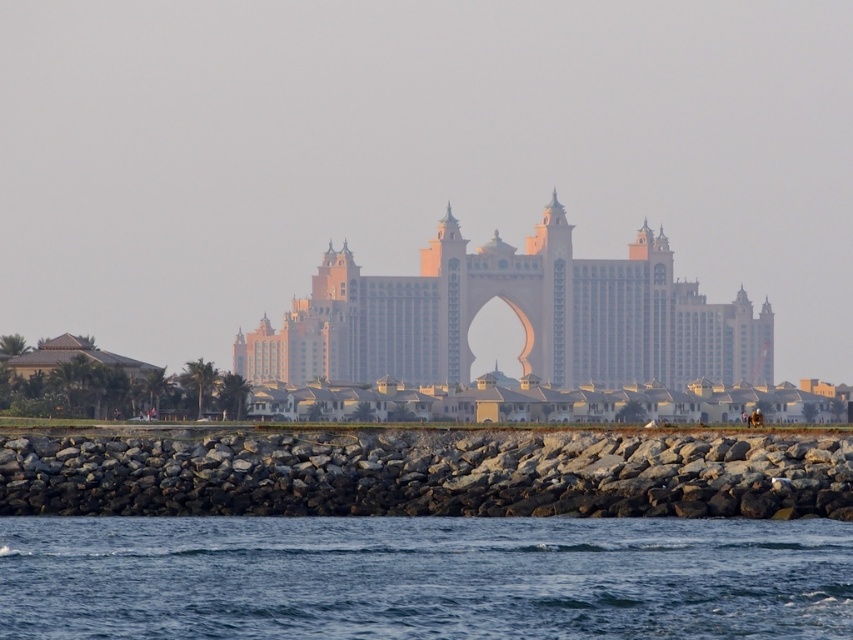
Question: Which point is closer to the camera taking this photo?

Choices:
 (A) (628, 291)
 (B) (163, 513)
 (C) (488, 636)

Answer: (B)

Question: Is blue water at lower center below golden stone palace at center?

Choices:
 (A) no
 (B) yes

Answer: (B)

Question: Does gray rock wall at lower center lie behind golden stone palace at center?

Choices:
 (A) yes
 (B) no

Answer: (B)

Question: Which object is the farthest from the blue water at lower center?

Choices:
 (A) gray rock wall at lower center
 (B) golden stone palace at center

Answer: (B)

Question: Which point appears farthest from the camera in this image?

Choices:
 (A) (633, 598)
 (B) (526, 285)

Answer: (B)

Question: Is gray rock wall at lower center to the left of golden stone palace at center from the viewer's perspective?

Choices:
 (A) yes
 (B) no

Answer: (A)